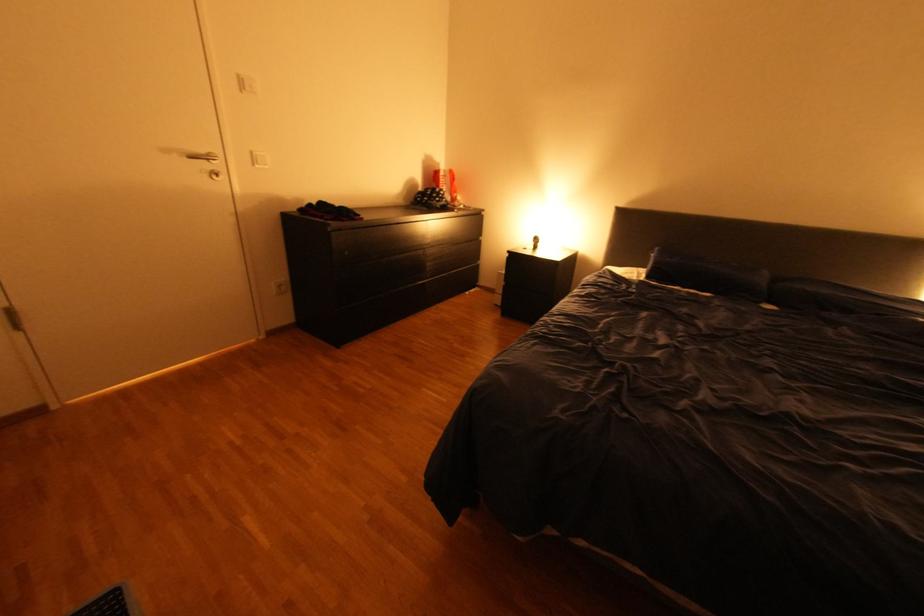
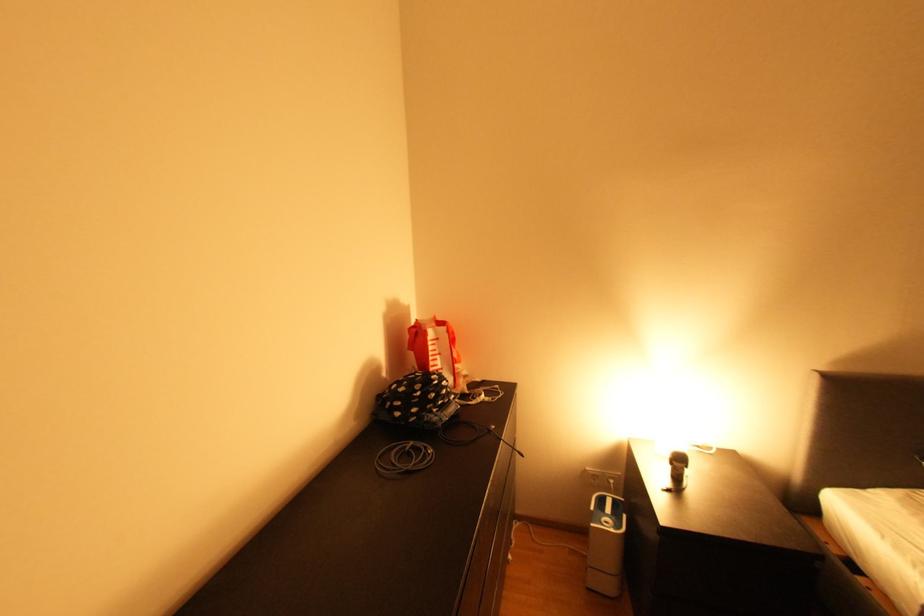
Where in the second image is the point corresponding to point 454,196 from the first image?

(457, 389)